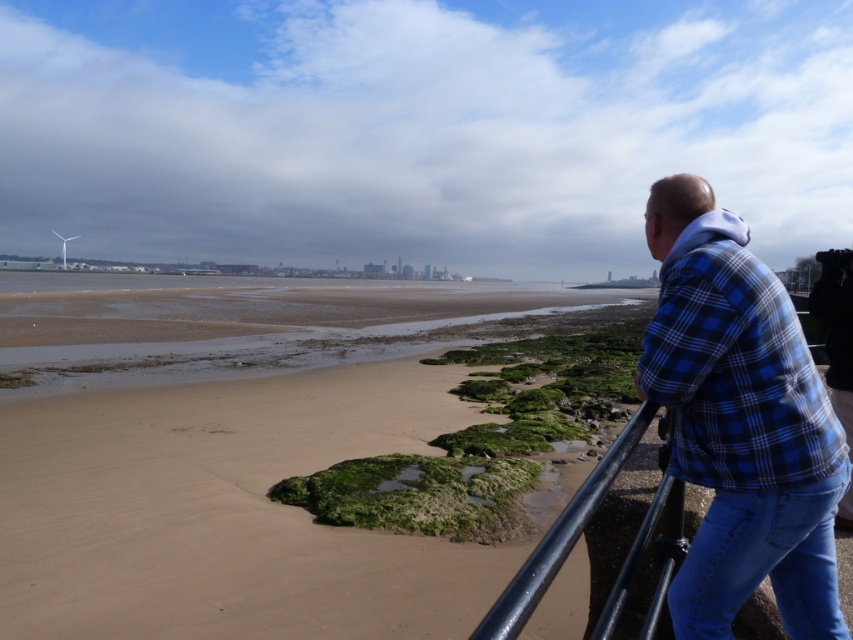
From the picture: You are standing at the point marked as point (740, 300) in the image. You want to take a photo of the city skyline in the distance. Can you fit the entire city skyline into your camera frame without moving? Explain your reasoning based on the distance between you and the camera.

The point (740, 300) and the camera are 1.41 meters apart. Since the distance between them is only 1.41 meters, you are very close to the camera. However, the city skyline is in the distance, so the camera should be able to capture the entire skyline as it is designed to focus on distant objects. The short distance between you and the camera doesn

You are a photographer trying to capture the person in the scene. Since you want to focus on their clothing, you need to know which part of their outfit is wider. Which is wider, the blue plaid shirt at right or the blue denim jeans at lower right?

The blue plaid shirt at right might be wider than blue denim jeans at lower right according to the description.